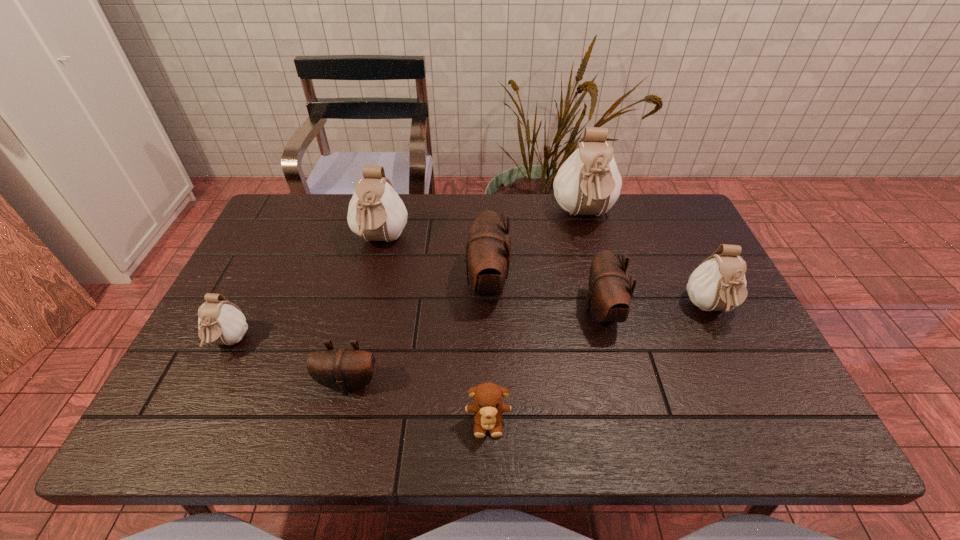
This screenshot has height=540, width=960. Identify the location of vacant space in between the rightmost pouch and the smallest white pouch. (469, 326).

What are the coordinates of `vacant area that lies between the rightmost brown pouch and the smallest white pouch` in the screenshot? It's located at (x=415, y=327).

You are a GUI agent. You are given a task and a screenshot of the screen. Output one action in this format:
    pyautogui.click(x=<x>, y=<y>)
    Task: Click on the object that can be found as the third closest to the leftmost pouch
    
    Given the screenshot: What is the action you would take?
    pyautogui.click(x=488, y=247)

The height and width of the screenshot is (540, 960). In order to click on object identified as the fourth closest to the brown teddy bear in this screenshot , I will do `click(376, 212)`.

Identify which pouch is the third closest to the leftmost object. Please provide its 2D coordinates. Your answer should be formatted as a tuple, i.e. [(x, y)], where the tuple contains the x and y coordinates of a point satisfying the conditions above.

[(488, 247)]

At what (x,y) coordinates should I click in order to perform the action: click on pouch that is the third closest to the rightmost pouch. Please return your answer as a coordinate pair (x, y). Image resolution: width=960 pixels, height=540 pixels. Looking at the image, I should click on (488, 247).

Choose which white pouch is the third nearest neighbor to the rightmost white pouch. Please provide its 2D coordinates. Your answer should be formatted as a tuple, i.e. [(x, y)], where the tuple contains the x and y coordinates of a point satisfying the conditions above.

[(220, 321)]

Identify which white pouch is located as the nearest to the leftmost object. Please provide its 2D coordinates. Your answer should be formatted as a tuple, i.e. [(x, y)], where the tuple contains the x and y coordinates of a point satisfying the conditions above.

[(376, 212)]

Choose which brown pouch is the nearest neighbor to the second biggest brown pouch. Please provide its 2D coordinates. Your answer should be formatted as a tuple, i.e. [(x, y)], where the tuple contains the x and y coordinates of a point satisfying the conditions above.

[(488, 247)]

Identify which brown pouch is located as the second nearest to the nearest brown pouch. Please provide its 2D coordinates. Your answer should be formatted as a tuple, i.e. [(x, y)], where the tuple contains the x and y coordinates of a point satisfying the conditions above.

[(609, 296)]